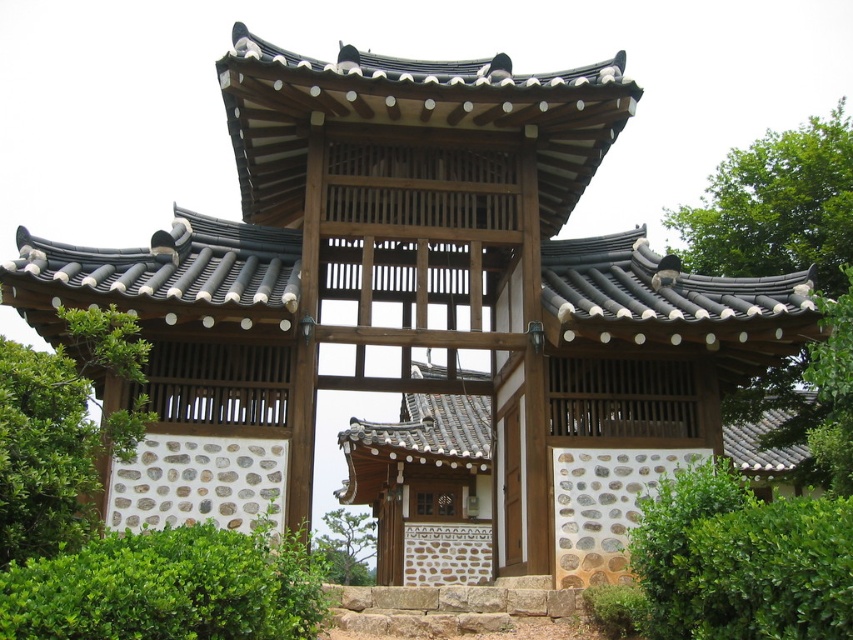
Question: Among these objects, which one is farthest from the camera?

Choices:
 (A) green leafy bush at lower left
 (B) green leafy bush at lower right

Answer: (B)

Question: Which of the following is the farthest from the observer?

Choices:
 (A) green leafy bush at lower right
 (B) green leafy tree at center

Answer: (B)

Question: Where is green leafy bush at lower left located in relation to green leafy tree at left in the image?

Choices:
 (A) left
 (B) right

Answer: (B)

Question: Is green leafy bush at lower left positioned behind green leafy tree at center?

Choices:
 (A) no
 (B) yes

Answer: (A)

Question: Which point is closer to the camera?

Choices:
 (A) green leafy tree at center
 (B) green leafy bush at lower right

Answer: (B)

Question: Can you confirm if green leafy bush at lower left is bigger than green leafy tree at left?

Choices:
 (A) yes
 (B) no

Answer: (B)